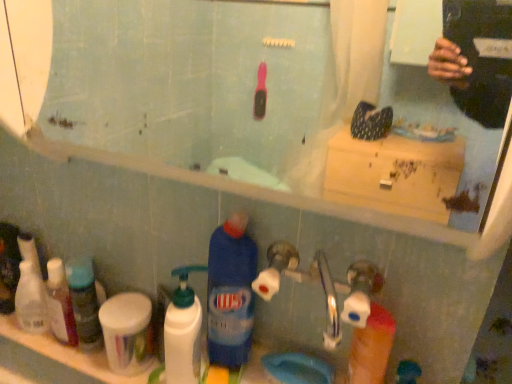
Describe the element at coordinates (231, 293) in the screenshot. I see `blue plastic bottle at lower center, the second cleaning product from the left` at that location.

Identify the location of white plastic cup at lower left, which appears as the 3th toiletry when viewed from the left. (84, 302).

You are a GUI agent. You are given a task and a screenshot of the screen. Output one action in this format:
    pyautogui.click(x=<x>, y=<y>)
    Task: Click on the translucent plastic bottles at left, which is the second toiletry in right-to-left order
    
    Given the screenshot: What is the action you would take?
    pyautogui.click(x=60, y=304)

Where is `blue plastic bottle at lower center, which is counted as the 1th cleaning product, starting from the right`? The width and height of the screenshot is (512, 384). blue plastic bottle at lower center, which is counted as the 1th cleaning product, starting from the right is located at coordinates (231, 293).

Is blue plastic bottle at lower center, the second cleaning product from the left, facing towards white plastic pump bottle at lower left, placed as the 2th cleaning product when sorted from right to left?

No, blue plastic bottle at lower center, the second cleaning product from the left, is not facing towards white plastic pump bottle at lower left, placed as the 2th cleaning product when sorted from right to left.

From the picture: Which point is more forward, (x=241, y=337) or (x=184, y=367)?

The point (x=184, y=367) is closer to the camera.

Which is more to the right, blue plastic bottle at lower center, the second cleaning product from the left, or white plastic pump bottle at lower left, the 1th cleaning product in the left-to-right sequence?

Positioned to the right is blue plastic bottle at lower center, the second cleaning product from the left.

Is blue plastic bottle at lower center, the second cleaning product from the left, in front of or behind white plastic pump bottle at lower left, the 1th cleaning product in the left-to-right sequence, in the image?

blue plastic bottle at lower center, the second cleaning product from the left, is behind white plastic pump bottle at lower left, the 1th cleaning product in the left-to-right sequence.

Between white plastic bottles at left, which appears as the first toiletry when viewed from the left, and white matte container at lower left, which one has smaller size?

Smaller between the two is white plastic bottles at left, which appears as the first toiletry when viewed from the left.

Would you consider white plastic bottles at left, which appears as the first toiletry when viewed from the left, to be distant from white matte container at lower left?

white plastic bottles at left, which appears as the first toiletry when viewed from the left, is near white matte container at lower left, not far away.

Is point (35, 276) in front of point (144, 366)?

No, (35, 276) is further to viewer.

Is white plastic cup at lower left, acting as the 1th toiletry starting from the right, at the right side of white plastic bottles at left, the 3th toiletry viewed from the right?

Yes, white plastic cup at lower left, acting as the 1th toiletry starting from the right, is to the right of white plastic bottles at left, the 3th toiletry viewed from the right.

From a real-world perspective, count 2nd toiletrys upward from the white plastic bottles at left, which appears as the first toiletry when viewed from the left, and point to it. Please provide its 2D coordinates.

[(84, 302)]

Which is closer, (86,320) or (35,286)?

Point (86,320) is positioned closer to the camera compared to point (35,286).

Looking at this image, from the image's perspective, is white plastic cup at lower left, which appears as the 3th toiletry when viewed from the left, positioned above or below white plastic bottles at left, which appears as the first toiletry when viewed from the left?

white plastic cup at lower left, which appears as the 3th toiletry when viewed from the left, is below white plastic bottles at left, which appears as the first toiletry when viewed from the left.

Based on the photo, does blue plastic bottle at lower center, which is counted as the 1th cleaning product, starting from the right, have a lesser height compared to white matte container at lower left?

In fact, blue plastic bottle at lower center, which is counted as the 1th cleaning product, starting from the right, may be taller than white matte container at lower left.

Is blue plastic bottle at lower center, the second cleaning product from the left, facing away from white matte container at lower left?

No, white matte container at lower left is not at the back of blue plastic bottle at lower center, the second cleaning product from the left.

From a real-world perspective, is blue plastic bottle at lower center, the second cleaning product from the left, on white matte container at lower left?

Indeed, from a real-world perspective, blue plastic bottle at lower center, the second cleaning product from the left, stands above white matte container at lower left.

Considering the positions of point (209, 256) and point (148, 362), is point (209, 256) closer or farther from the camera than point (148, 362)?

Point (209, 256).

Image resolution: width=512 pixels, height=384 pixels. Identify the location of toiletry below the translucent plastic bottles at left, which is the second toiletry in left-to-right order (from the image's perspective). [x=84, y=302].

Do you think translucent plastic bottles at left, which is the second toiletry in left-to-right order, is within white plastic cup at lower left, acting as the 1th toiletry starting from the right, or outside of it?

translucent plastic bottles at left, which is the second toiletry in left-to-right order, lies outside white plastic cup at lower left, acting as the 1th toiletry starting from the right.

Is translucent plastic bottles at left, which is the second toiletry in right-to-left order, oriented away from white plastic cup at lower left, acting as the 1th toiletry starting from the right?

translucent plastic bottles at left, which is the second toiletry in right-to-left order, is not turned away from white plastic cup at lower left, acting as the 1th toiletry starting from the right.

What's the angular difference between translucent plastic bottles at left, which is the second toiletry in right-to-left order, and white plastic cup at lower left, which appears as the 3th toiletry when viewed from the left,'s facing directions?

They differ by 2.29 degrees in their facing directions.

Does white plastic bottles at left, the 3th toiletry viewed from the right, have a greater width compared to translucent plastic bottles at left, which is the second toiletry in right-to-left order?

No.

Considering the points (36, 282) and (76, 339), which point is behind, point (36, 282) or point (76, 339)?

The point (36, 282) is more distant.

Is white plastic bottles at left, the 3th toiletry viewed from the right, inside or outside of translucent plastic bottles at left, which is the second toiletry in right-to-left order?

white plastic bottles at left, the 3th toiletry viewed from the right, is outside translucent plastic bottles at left, which is the second toiletry in right-to-left order.

From a real-world perspective, is white plastic bottles at left, which appears as the first toiletry when viewed from the left, located higher than translucent plastic bottles at left, which is the second toiletry in left-to-right order?

No, from a real-world perspective, white plastic bottles at left, which appears as the first toiletry when viewed from the left, is not on top of translucent plastic bottles at left, which is the second toiletry in left-to-right order.

Considering the sizes of white plastic cup at lower left, which appears as the 3th toiletry when viewed from the left, and blue plastic bottle at lower center, the second cleaning product from the left, in the image, is white plastic cup at lower left, which appears as the 3th toiletry when viewed from the left, wider or thinner than blue plastic bottle at lower center, the second cleaning product from the left,?

Clearly, white plastic cup at lower left, which appears as the 3th toiletry when viewed from the left, has less width compared to blue plastic bottle at lower center, the second cleaning product from the left.

Is white plastic cup at lower left, which appears as the 3th toiletry when viewed from the left, outside of blue plastic bottle at lower center, the second cleaning product from the left?

Absolutely, white plastic cup at lower left, which appears as the 3th toiletry when viewed from the left, is external to blue plastic bottle at lower center, the second cleaning product from the left.

Measure the distance between white plastic cup at lower left, which appears as the 3th toiletry when viewed from the left, and blue plastic bottle at lower center, which is counted as the 1th cleaning product, starting from the right.

white plastic cup at lower left, which appears as the 3th toiletry when viewed from the left, and blue plastic bottle at lower center, which is counted as the 1th cleaning product, starting from the right, are 13.06 inches apart.

From a real-world perspective, which cleaning product is the 2nd one above the white plastic cup at lower left, which appears as the 3th toiletry when viewed from the left? Please provide its 2D coordinates.

[(231, 293)]

This screenshot has width=512, height=384. I want to click on cleaning product that appears above the white plastic pump bottle at lower left, the 1th cleaning product in the left-to-right sequence (from the image's perspective), so click(231, 293).

Where is `the 3rd toiletry to the left when counting from the white matte container at lower left`? The width and height of the screenshot is (512, 384). the 3rd toiletry to the left when counting from the white matte container at lower left is located at coordinates (31, 300).

Considering their positions, is white plastic bottles at left, which appears as the first toiletry when viewed from the left, positioned closer to white plastic pump bottle at lower left, placed as the 2th cleaning product when sorted from right to left, than white matte container at lower left?

white matte container at lower left.

Which object lies further to the anchor point white plastic cup at lower left, acting as the 1th toiletry starting from the right, white plastic pump bottle at lower left, placed as the 2th cleaning product when sorted from right to left, or white matte container at lower left?

white plastic pump bottle at lower left, placed as the 2th cleaning product when sorted from right to left.

When comparing their distances from white plastic cup at lower left, which appears as the 3th toiletry when viewed from the left, does blue plastic bottle at lower center, the second cleaning product from the left, or white plastic pump bottle at lower left, the 1th cleaning product in the left-to-right sequence, seem further?

The object further to white plastic cup at lower left, which appears as the 3th toiletry when viewed from the left, is blue plastic bottle at lower center, the second cleaning product from the left.

Considering their positions, is blue plastic bottle at lower center, the second cleaning product from the left, positioned further to white matte container at lower left than white plastic cup at lower left, acting as the 1th toiletry starting from the right?

blue plastic bottle at lower center, the second cleaning product from the left, is positioned further to the anchor white matte container at lower left.

Consider the image. When comparing their distances from white plastic bottles at left, the 3th toiletry viewed from the right, does white matte container at lower left or blue plastic bottle at lower center, the second cleaning product from the left, seem closer?

white matte container at lower left lies closer to white plastic bottles at left, the 3th toiletry viewed from the right, than the other object.

Considering their positions, is translucent plastic bottles at left, which is the second toiletry in right-to-left order, positioned closer to white plastic cup at lower left, which appears as the 3th toiletry when viewed from the left, than white matte container at lower left?

translucent plastic bottles at left, which is the second toiletry in right-to-left order.

Looking at the image, which one is located further to translucent plastic bottles at left, which is the second toiletry in left-to-right order, blue plastic bottle at lower center, which is counted as the 1th cleaning product, starting from the right, or white plastic bottles at left, the 3th toiletry viewed from the right?

Based on the image, blue plastic bottle at lower center, which is counted as the 1th cleaning product, starting from the right, appears to be further to translucent plastic bottles at left, which is the second toiletry in left-to-right order.

Which object lies nearer to the anchor point blue plastic bottle at lower center, the second cleaning product from the left, white matte container at lower left or white plastic cup at lower left, acting as the 1th toiletry starting from the right?

Among the two, white matte container at lower left is located nearer to blue plastic bottle at lower center, the second cleaning product from the left.

Find the location of a particular element. cleaning product situated between white plastic bottles at left, the 3th toiletry viewed from the right, and blue plastic bottle at lower center, the second cleaning product from the left, from left to right is located at coordinates (183, 331).

At what (x,y) coordinates should I click in order to perform the action: click on mouthwash located between translucent plastic bottles at left, which is the second toiletry in left-to-right order, and white plastic pump bottle at lower left, placed as the 2th cleaning product when sorted from right to left, in the left-right direction. Please return your answer as a coordinate pair (x, y). Looking at the image, I should click on (127, 332).

I want to click on mouthwash located between white plastic bottles at left, which appears as the first toiletry when viewed from the left, and white plastic pump bottle at lower left, the 1th cleaning product in the left-to-right sequence, in the left-right direction, so click(127, 332).

Where is `mouthwash located between white plastic bottles at left, the 3th toiletry viewed from the right, and blue plastic bottle at lower center, the second cleaning product from the left, in the left-right direction`? The width and height of the screenshot is (512, 384). mouthwash located between white plastic bottles at left, the 3th toiletry viewed from the right, and blue plastic bottle at lower center, the second cleaning product from the left, in the left-right direction is located at coordinates (127, 332).